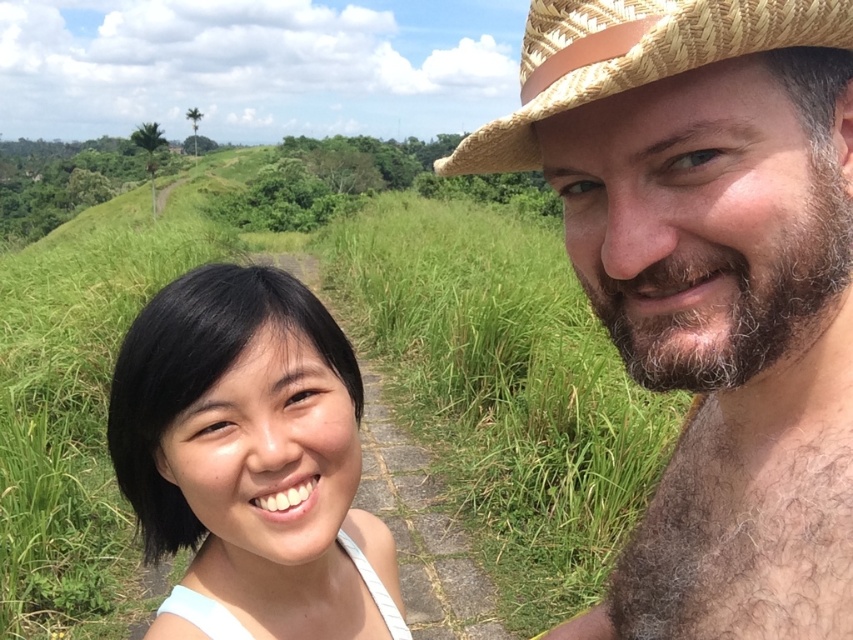
Does natural straw hat at center have a larger size compared to brown woven cowboy hat at upper right?

Correct, natural straw hat at center is larger in size than brown woven cowboy hat at upper right.

Which is more to the right, natural straw hat at center or brown woven cowboy hat at upper right?

From the viewer's perspective, natural straw hat at center appears more on the right side.

Who is more forward, (668, 285) or (850, 29)?

Point (850, 29) is more forward.

Where is `natural straw hat at center`? The width and height of the screenshot is (853, 640). natural straw hat at center is located at coordinates (711, 285).

Does natural straw hat at center lie behind black hair at center?

No, it is not.

Between natural straw hat at center and black hair at center, which one appears on the right side from the viewer's perspective?

natural straw hat at center is more to the right.

Which is behind, point (607, 289) or point (194, 541)?

The point (194, 541) is more distant.

At what (x,y) coordinates should I click in order to perform the action: click on natural straw hat at center. Please return your answer as a coordinate pair (x, y). The width and height of the screenshot is (853, 640). Looking at the image, I should click on coord(711,285).

In the scene shown: Which of these two, natural straw hat at center or green grass at center, stands taller?

green grass at center is taller.

The image size is (853, 640). What are the coordinates of `natural straw hat at center` in the screenshot? It's located at (711, 285).